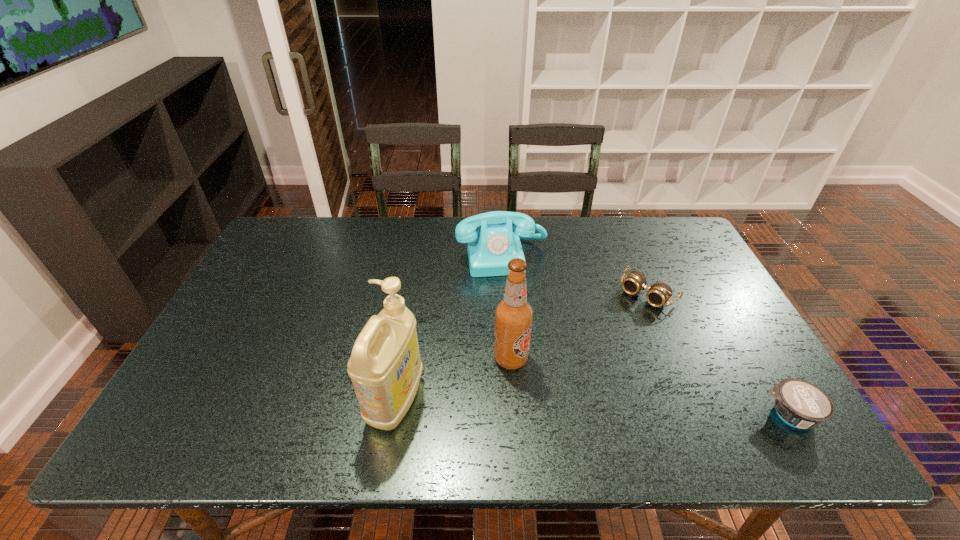
Where is `vacant region located 0.120m through the lenses of the goggles`? vacant region located 0.120m through the lenses of the goggles is located at coordinates (612, 332).

Where is `free space located 0.100m through the lenses of the goggles`? free space located 0.100m through the lenses of the goggles is located at coordinates (616, 327).

Locate an element on the screen. The image size is (960, 540). free location located through the lenses of the goggles is located at coordinates (569, 381).

You are a GUI agent. You are given a task and a screenshot of the screen. Output one action in this format:
    pyautogui.click(x=<x>, y=<y>)
    Task: Click on the free space located on the front label of the beer bottle
    The width and height of the screenshot is (960, 540).
    Given the screenshot: What is the action you would take?
    coord(575,401)

This screenshot has width=960, height=540. What are the coordinates of `vacant region located on the front label of the beer bottle` in the screenshot? It's located at (567, 396).

I want to click on free space located on the front label of the beer bottle, so click(x=564, y=393).

Identify the location of object located in the far edge section of the desktop. (490, 249).

At what (x,y) coordinates should I click in order to perform the action: click on detergent that is at the near edge. Please return your answer as a coordinate pair (x, y). This screenshot has height=540, width=960. Looking at the image, I should click on (385, 367).

You are a GUI agent. You are given a task and a screenshot of the screen. Output one action in this format:
    pyautogui.click(x=<x>, y=<y>)
    Task: Click on the yogurt at the near edge
    
    Given the screenshot: What is the action you would take?
    pyautogui.click(x=801, y=404)

Image resolution: width=960 pixels, height=540 pixels. I want to click on yogurt at the right edge, so point(801,404).